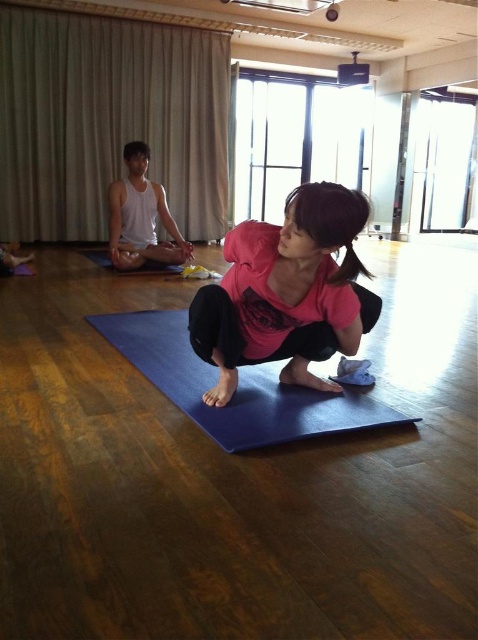
Question: Which is nearer to the blue rubber mat at center?

Choices:
 (A) blue rubber yoga mat at center
 (B) pink matte shirt at center

Answer: (A)

Question: Which object is the closest to the blue rubber yoga mat at center?

Choices:
 (A) white tank top at center
 (B) blue rubber mat at center
 (C) pink matte shirt at center

Answer: (C)

Question: Is pink matte shirt at center smaller than white tank top at center?

Choices:
 (A) no
 (B) yes

Answer: (B)

Question: Does pink matte shirt at center appear on the left side of white tank top at center?

Choices:
 (A) yes
 (B) no

Answer: (B)

Question: Where is pink matte shirt at center located in relation to blue rubber mat at center in the image?

Choices:
 (A) above
 (B) below

Answer: (B)

Question: Among these points, which one is farthest from the camera?

Choices:
 (A) (95, 250)
 (B) (278, 296)
 (C) (239, 396)

Answer: (A)